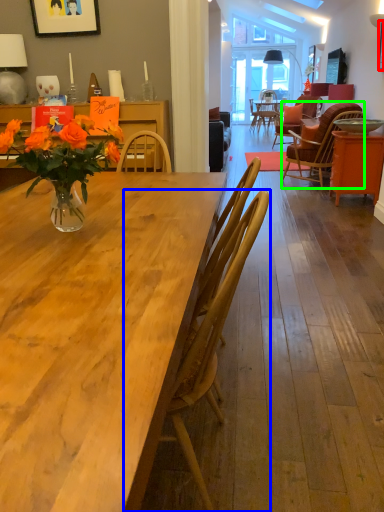
Question: Considering the real-world distances, which object is closest to picture frame (highlighted by a red box)? chair (highlighted by a blue box) or chair (highlighted by a green box).

Choices:
 (A) chair
 (B) chair

Answer: (B)